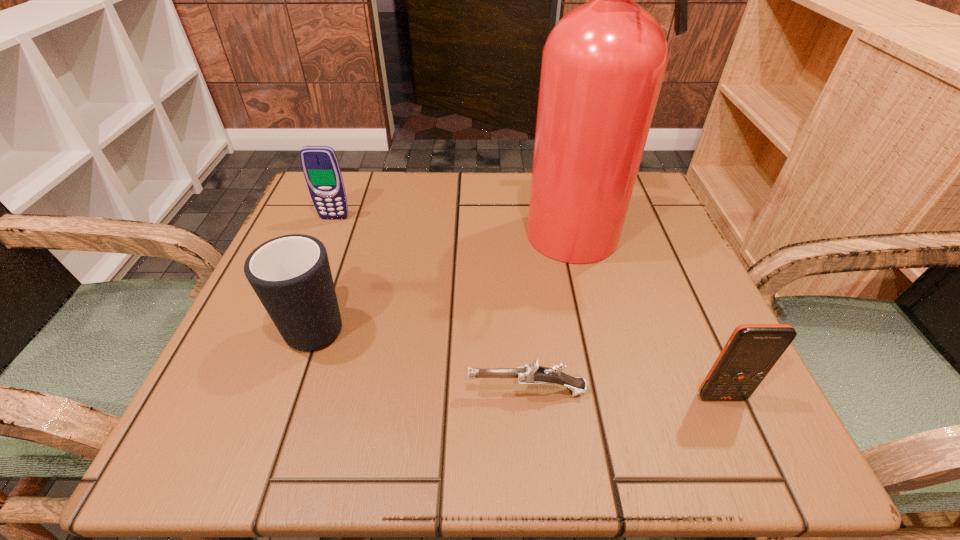
You are a GUI agent. You are given a task and a screenshot of the screen. Output one action in this format:
    pyautogui.click(x=<x>, y=<y>)
    Task: Click on the tallest object
    The width and height of the screenshot is (960, 540).
    Given the screenshot: What is the action you would take?
    pyautogui.click(x=603, y=64)

Find the location of a particular element. The width and height of the screenshot is (960, 540). the left cellular telephone is located at coordinates (320, 165).

Identify the location of mug. (290, 274).

What are the coordinates of `the nearer cellular telephone` in the screenshot? It's located at (752, 350).

Find the location of `gun`. gun is located at coordinates (531, 374).

I want to click on free location located on the front of the fire extinguisher, so click(x=625, y=357).

This screenshot has width=960, height=540. In order to click on vacant space located 0.360m on the front-facing side of the left cellular telephone in this screenshot , I will do `click(276, 365)`.

Find the location of a particular element. The image size is (960, 540). free spot located 0.320m on the side of the mug with the handle is located at coordinates (364, 187).

Locate an element on the screen. free space located 0.380m on the side of the mug with the handle is located at coordinates (369, 173).

Locate an element on the screen. The height and width of the screenshot is (540, 960). vacant space located on the side of the mug with the handle is located at coordinates (362, 192).